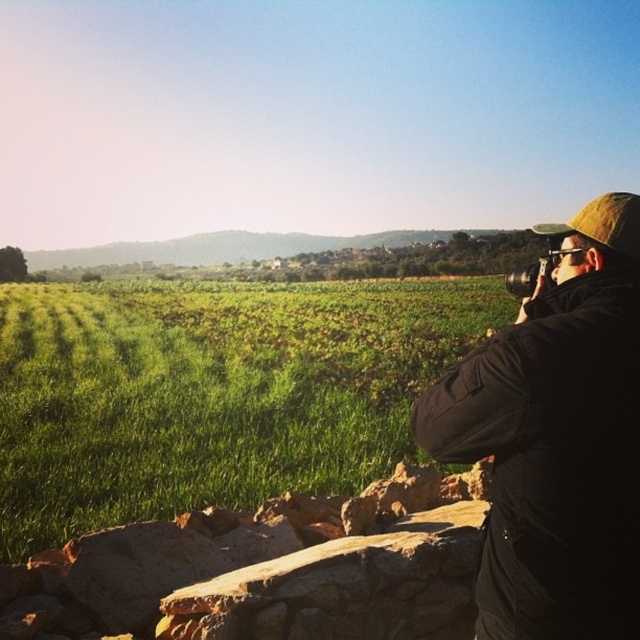
Between black fabric camera at right and black plastic camera at upper right, which one has less height?

black plastic camera at upper right

Can you confirm if black fabric camera at right is smaller than black plastic camera at upper right?

Indeed, black fabric camera at right has a smaller size compared to black plastic camera at upper right.

Which is behind, point (452, 433) or point (529, 292)?

The point (529, 292) is behind.

You are a GUI agent. You are given a task and a screenshot of the screen. Output one action in this format:
    pyautogui.click(x=<x>, y=<y>)
    Task: Click on the black fabric camera at right
    This screenshot has height=640, width=640.
    Given the screenshot: What is the action you would take?
    coord(556,440)